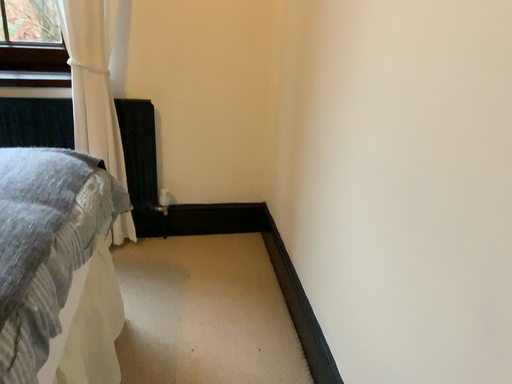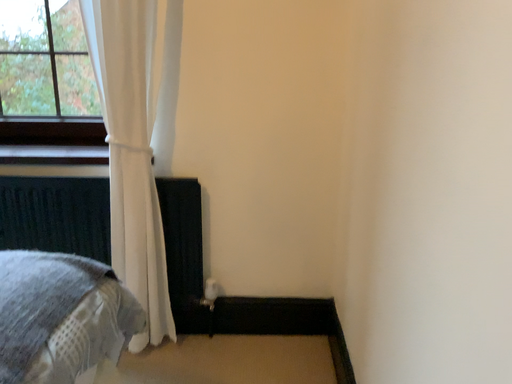
Question: Which way did the camera rotate in the video?

Choices:
 (A) rotated right
 (B) rotated left

Answer: (B)